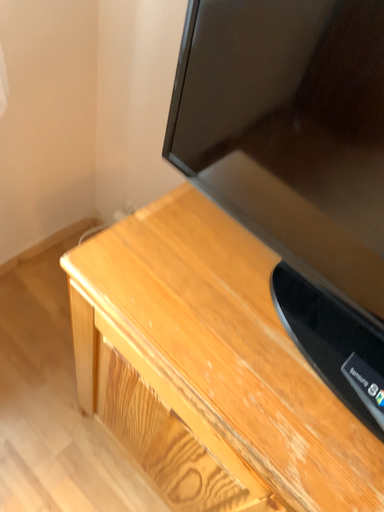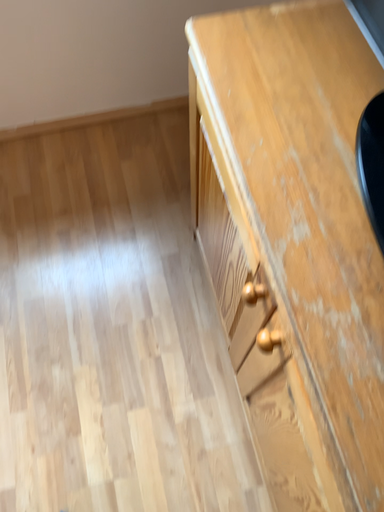
Question: How did the camera likely rotate when shooting the video?

Choices:
 (A) rotated left
 (B) rotated right

Answer: (A)